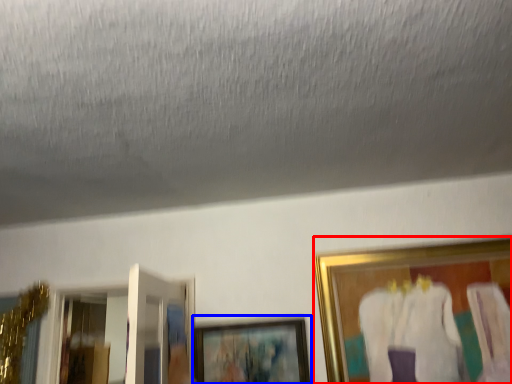
Question: Which of the following is the farthest to the observer, picture frame (highlighted by a red box) or picture frame (highlighted by a blue box)?

Choices:
 (A) picture frame
 (B) picture frame

Answer: (B)